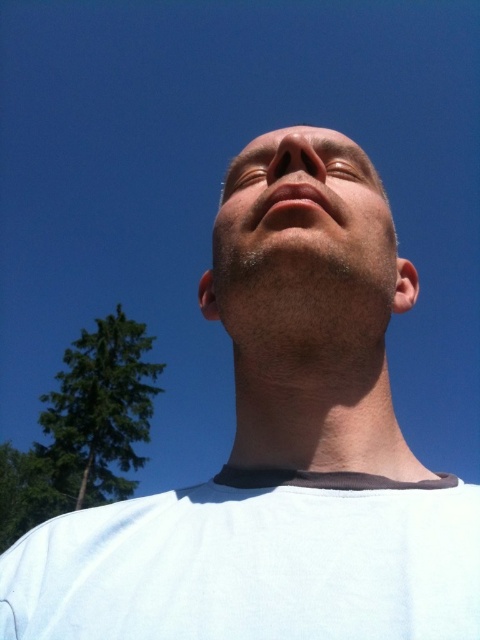
Question: Among these points, which one is nearest to the camera?

Choices:
 (A) (310, 168)
 (B) (237, 292)
 (C) (420, 481)

Answer: (C)

Question: Estimate the real-world distances between objects in this image. Which object is farther from the brown matte eye at upper center?

Choices:
 (A) smooth skin face at center
 (B) smooth skin nose at center

Answer: (A)

Question: Among these objects, which one is nearest to the camera?

Choices:
 (A) smooth skin head at center
 (B) smooth skin nose at center
 (C) smooth skin face at center
 (D) matte gold eye at upper center

Answer: (A)

Question: Is smooth skin face at center further to camera compared to brown matte eye at upper center?

Choices:
 (A) yes
 (B) no

Answer: (B)

Question: Does smooth skin head at center have a greater width compared to matte gold eye at upper center?

Choices:
 (A) yes
 (B) no

Answer: (A)

Question: Does smooth skin face at center appear on the right side of matte gold eye at upper center?

Choices:
 (A) yes
 (B) no

Answer: (A)